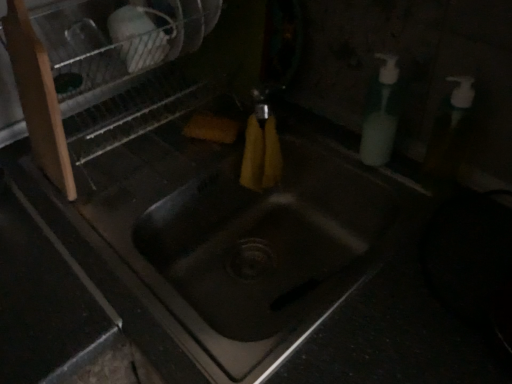
Question: Is white plastic soap dispenser at right taller than metallic silver dish rack at upper left?

Choices:
 (A) no
 (B) yes

Answer: (A)

Question: Could you tell me if white plastic soap dispenser at right is turned towards metallic silver dish rack at upper left?

Choices:
 (A) no
 (B) yes

Answer: (A)

Question: Are white plastic soap dispenser at right and metallic silver dish rack at upper left far apart?

Choices:
 (A) yes
 (B) no

Answer: (B)

Question: Would you say white plastic soap dispenser at right is outside metallic silver dish rack at upper left?

Choices:
 (A) yes
 (B) no

Answer: (A)

Question: From the image's perspective, is white plastic soap dispenser at right under metallic silver dish rack at upper left?

Choices:
 (A) yes
 (B) no

Answer: (A)

Question: From a real-world perspective, is white plastic soap dispenser at right beneath metallic silver dish rack at upper left?

Choices:
 (A) no
 (B) yes

Answer: (B)

Question: Is metallic silver dish rack at upper left bigger than white plastic soap dispenser at right?

Choices:
 (A) no
 (B) yes

Answer: (B)

Question: Does metallic silver dish rack at upper left have a lesser height compared to white plastic soap dispenser at right?

Choices:
 (A) yes
 (B) no

Answer: (B)

Question: Could white plastic soap dispenser at right be considered to be inside metallic silver dish rack at upper left?

Choices:
 (A) no
 (B) yes

Answer: (A)

Question: Is metallic silver dish rack at upper left taller than white plastic soap dispenser at right?

Choices:
 (A) yes
 (B) no

Answer: (A)

Question: Considering the relative positions of metallic silver dish rack at upper left and white plastic soap dispenser at right in the image provided, is metallic silver dish rack at upper left to the left of white plastic soap dispenser at right from the viewer's perspective?

Choices:
 (A) no
 (B) yes

Answer: (B)

Question: Is metallic silver dish rack at upper left located outside white plastic soap dispenser at right?

Choices:
 (A) yes
 (B) no

Answer: (A)

Question: Looking at their shapes, would you say white plastic soap dispenser at right is wider or thinner than metallic silver dish rack at upper left?

Choices:
 (A) wide
 (B) thin

Answer: (B)